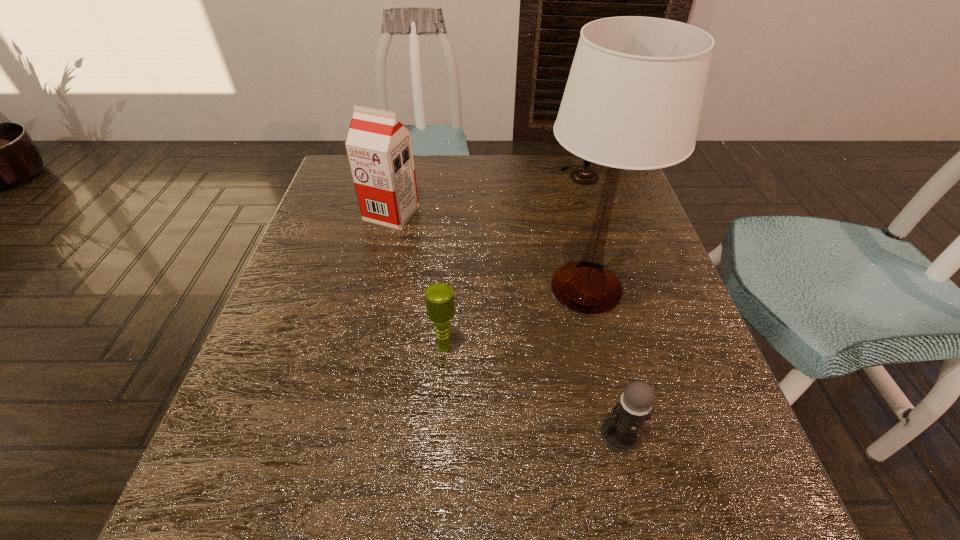
The height and width of the screenshot is (540, 960). I want to click on free point between the second tallest object and the nearest object, so click(x=505, y=323).

At what (x,y) coordinates should I click in order to perform the action: click on blank region between the fourth shortest object and the nearest microphone. Please return your answer as a coordinate pair (x, y). The image size is (960, 540). Looking at the image, I should click on click(x=505, y=323).

Image resolution: width=960 pixels, height=540 pixels. In order to click on free space between the leftmost microphone and the nearest microphone in this screenshot , I will do `click(532, 390)`.

Where is `vacant area that lies between the nearest object and the second tallest object`? This screenshot has height=540, width=960. vacant area that lies between the nearest object and the second tallest object is located at coordinates (505, 323).

Where is `free spot between the nearest microphone and the tallest object`? free spot between the nearest microphone and the tallest object is located at coordinates (603, 360).

Where is `free spot between the nearest object and the table lamp`? free spot between the nearest object and the table lamp is located at coordinates pyautogui.click(x=603, y=360).

Where is `free space between the second object from left to right and the fourth nearest object`? The image size is (960, 540). free space between the second object from left to right and the fourth nearest object is located at coordinates (419, 280).

The height and width of the screenshot is (540, 960). Identify the location of object that ranks as the second closest to the nearest object. (439, 297).

The image size is (960, 540). I want to click on object that is the nearest to the farthest object, so click(633, 99).

Locate an element on the screen. microphone that stands as the closest to the table lamp is located at coordinates (439, 297).